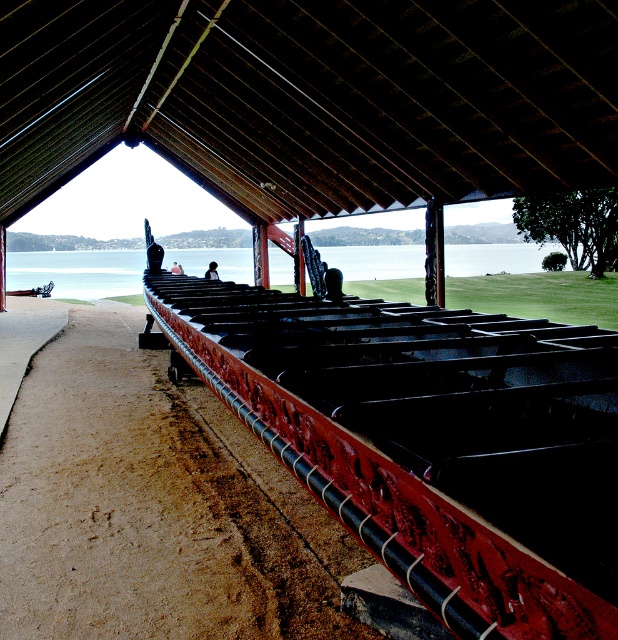
Question: Which object appears farthest from the camera in this image?

Choices:
 (A) rustic wood canoe at center
 (B) dark brown wooden roof at center
 (C) clear water at center

Answer: (C)

Question: Can you confirm if dark brown wooden roof at center is bigger than light brown wooden person at center?

Choices:
 (A) no
 (B) yes

Answer: (B)

Question: Is rustic wood canoe at center wider than dark hair at center?

Choices:
 (A) yes
 (B) no

Answer: (A)

Question: Which object appears closest to the camera in this image?

Choices:
 (A) dark hair at center
 (B) brown sandy dirt track at lower left
 (C) light brown wooden person at center
 (D) dark brown wooden roof at center

Answer: (B)

Question: Which object appears farthest from the camera in this image?

Choices:
 (A) rustic wood canoe at center
 (B) light brown wooden person at center
 (C) clear water at center

Answer: (B)

Question: Can you confirm if brown sandy dirt track at lower left is thinner than clear water at center?

Choices:
 (A) yes
 (B) no

Answer: (A)